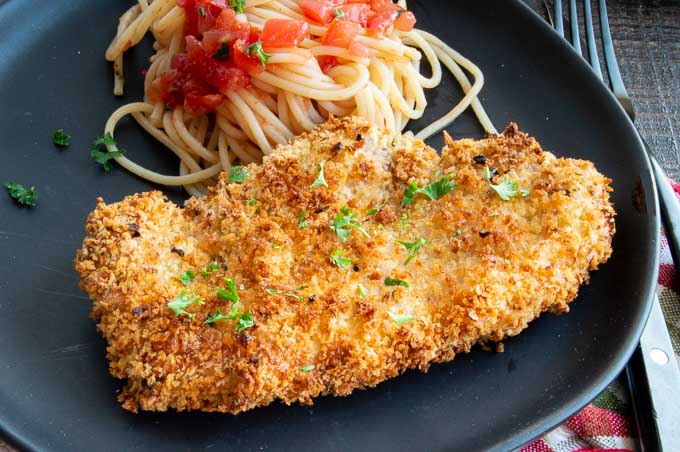
This screenshot has height=452, width=680. What are the coordinates of `round black matte plate` in the screenshot? It's located at (54, 311).